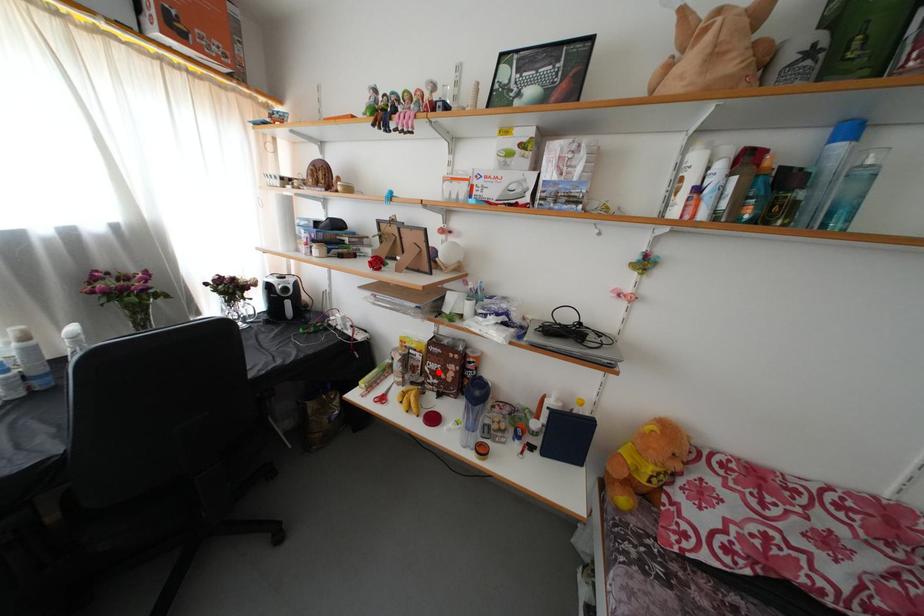
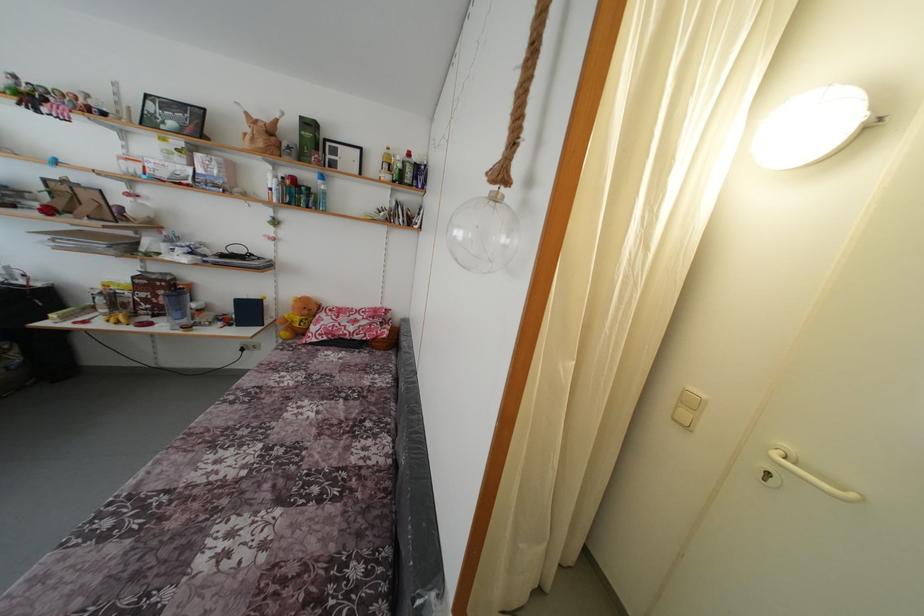
Where in the second image is the point corresponding to the highlighted location from the first image?

(149, 301)